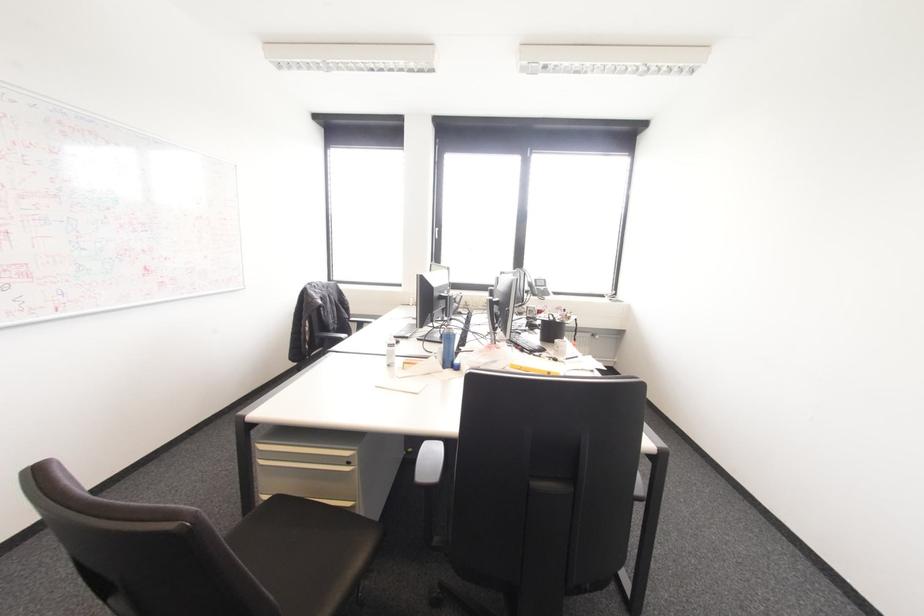
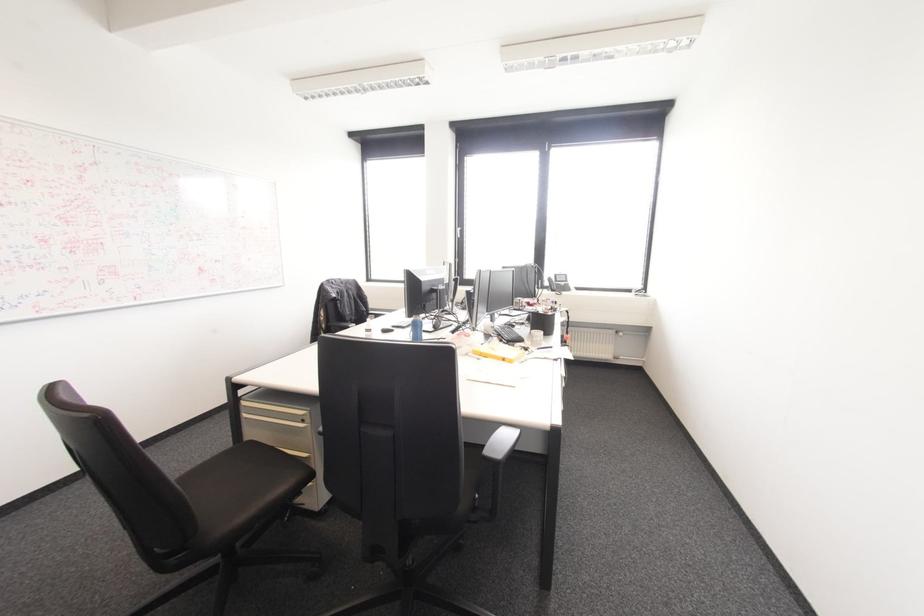
In the second image, find the point that corresponds to (347,463) in the first image.

(302, 419)